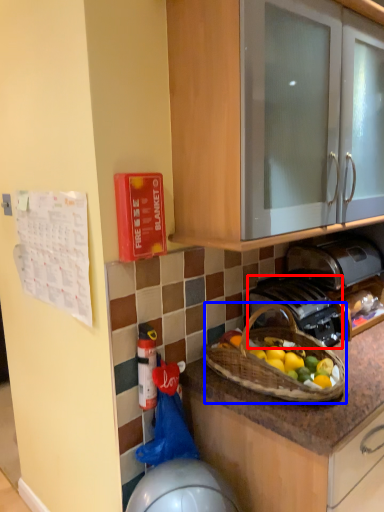
Question: Which object appears farthest to the camera in this image, gas stove (highlighted by a red box) or picnic basket (highlighted by a blue box)?

Choices:
 (A) gas stove
 (B) picnic basket

Answer: (A)